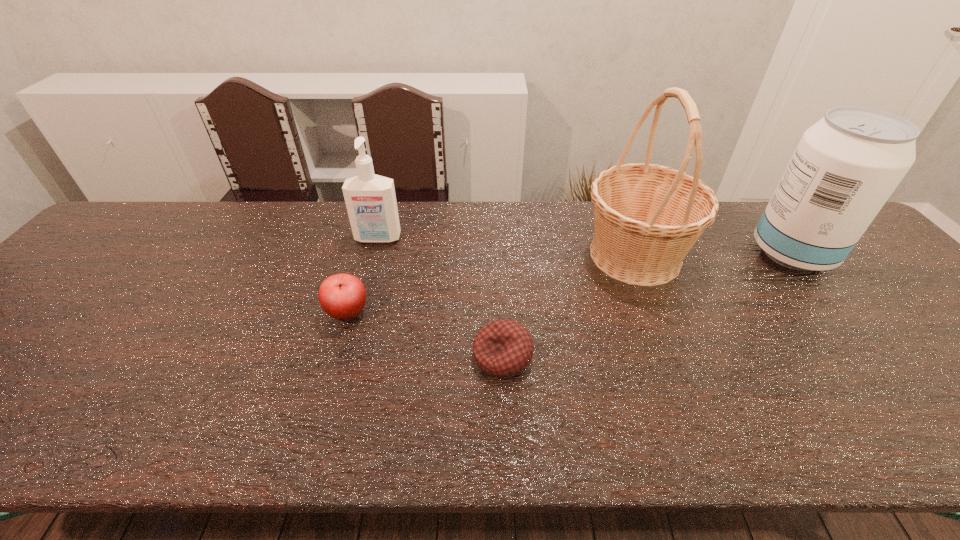
Where is `vacant space that satisfies the following two spatial constraints: 1. on the front label of the nearest object; 2. on the left side of the cleansing agent`? The image size is (960, 540). vacant space that satisfies the following two spatial constraints: 1. on the front label of the nearest object; 2. on the left side of the cleansing agent is located at coordinates (346, 356).